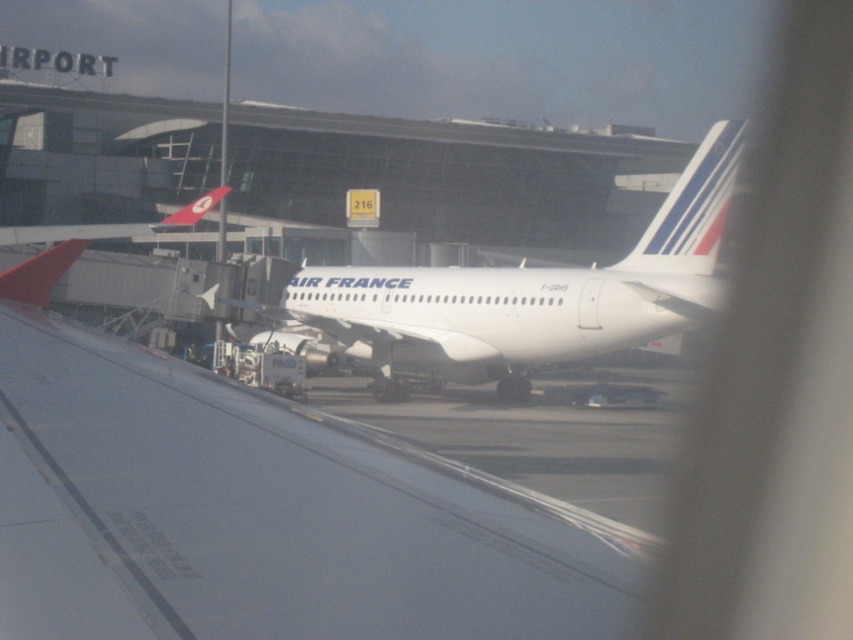
Is white glossy airplane at center taller than white/smooth tail at center?

Correct, white glossy airplane at center is much taller as white/smooth tail at center.

Based on the photo, who is more forward, (651, 305) or (647, 264)?

Point (651, 305)

Find the location of a particular element. Image resolution: width=853 pixels, height=640 pixels. white glossy airplane at center is located at coordinates (525, 292).

Which is behind, point (281, 413) or point (693, 177)?

The point (693, 177) is more distant.

The height and width of the screenshot is (640, 853). I want to click on white matte wing at center, so click(x=265, y=515).

Where is `white matte wing at center`? white matte wing at center is located at coordinates (265, 515).

At what (x,y) coordinates should I click in order to perform the action: click on white matte wing at center. Please return your answer as a coordinate pair (x, y). Looking at the image, I should click on (265, 515).

Can you confirm if white matte wing at center is wider than white/smooth tail at center?

Yes, white matte wing at center is wider than white/smooth tail at center.

Describe the element at coordinates (265, 515) in the screenshot. The width and height of the screenshot is (853, 640). I see `white matte wing at center` at that location.

Where is `white matte wing at center`? This screenshot has height=640, width=853. white matte wing at center is located at coordinates (265, 515).